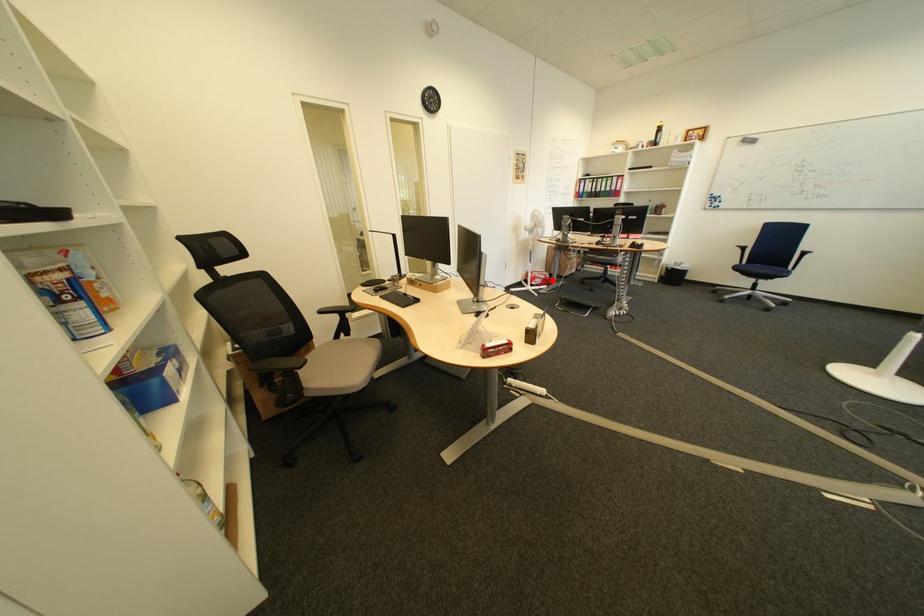
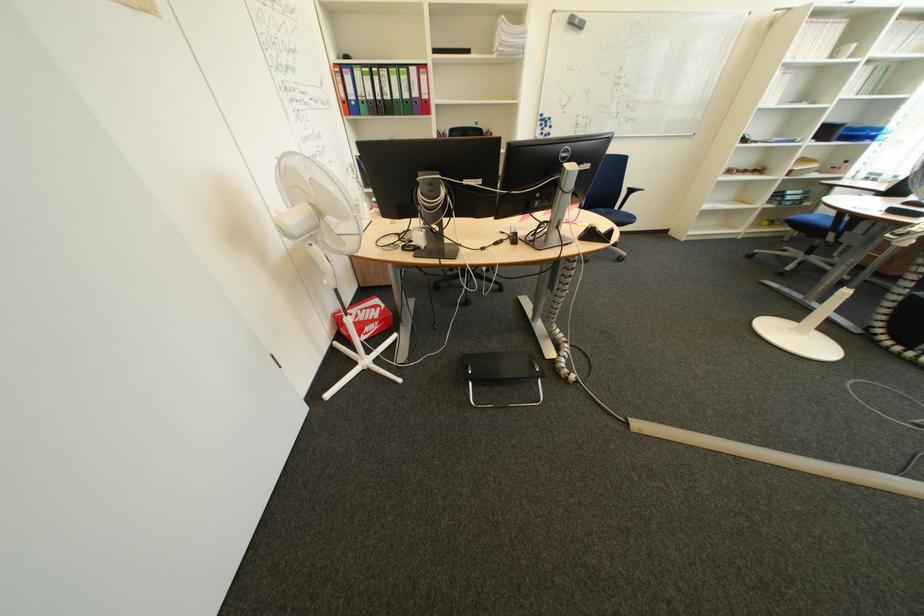
In the second image, find the point that corresponds to the highlighted location in the first image.

(385, 326)